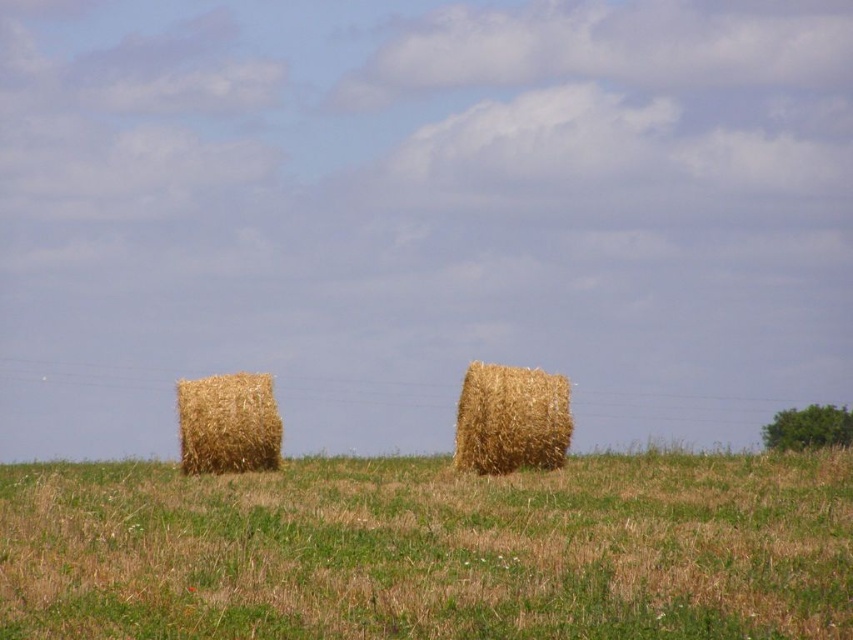
You are a farmer standing in the middle of the field and see the brown straw bales at center and the golden straw bale at center. Which one is positioned to the left?

The brown straw bales at center are positioned to the left of the golden straw bale at center.

You are a farmer who needs to move a 2.5 meter wide tractor between the brown straw bales at center and the golden straw bale at center. Based on the scene, will the tractor fit through the space between them?

The brown straw bales at center and golden straw bale at center are 3.00 meters apart, so the tractor with a width of 2.5 meters can fit through the space between them since 2.5 meters is less than 3.00 meters.